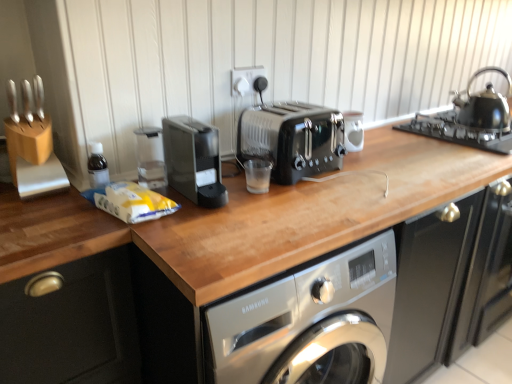
Describe the element at coordinates (353, 130) in the screenshot. I see `white glossy coffee cup at center` at that location.

In order to click on black plastic coffee machine at center in this screenshot , I will do `click(193, 160)`.

Find the location of a particular element. The height and width of the screenshot is (384, 512). wooden at center is located at coordinates (228, 264).

Image resolution: width=512 pixels, height=384 pixels. Describe the element at coordinates (228, 264) in the screenshot. I see `wooden at center` at that location.

What do you see at coordinates (33, 99) in the screenshot? This screenshot has width=512, height=384. I see `wooden knife block at upper left` at bounding box center [33, 99].

I want to click on white glossy coffee cup at center, so click(353, 130).

What's the angular difference between shiny black kettle at upper right and matte black knob at upper center's facing directions?

The facing directions of shiny black kettle at upper right and matte black knob at upper center are 4.91 degrees apart.

In the image, is shiny black kettle at upper right positioned in front of or behind matte black knob at upper center?

Visually, shiny black kettle at upper right is located behind matte black knob at upper center.

From a real-world perspective, who is located higher, shiny black kettle at upper right or matte black knob at upper center?

matte black knob at upper center is physically above.

Would you say shiny black kettle at upper right is inside or outside matte black knob at upper center?

shiny black kettle at upper right is located beyond the bounds of matte black knob at upper center.

Does black plastic coffee machine at center have a smaller size compared to white plastic socket at upper center?

Actually, black plastic coffee machine at center might be larger than white plastic socket at upper center.

From the image's perspective, does black plastic coffee machine at center appear lower than white plastic socket at upper center?

Indeed, from the image's perspective, black plastic coffee machine at center is shown beneath white plastic socket at upper center.

Considering the relative sizes of black plastic coffee machine at center and white plastic socket at upper center in the image provided, is black plastic coffee machine at center taller than white plastic socket at upper center?

Yes.

How much distance is there between black plastic coffee machine at center and white plastic socket at upper center?

A distance of 15.43 inches exists between black plastic coffee machine at center and white plastic socket at upper center.

In the scene shown: From the image's perspective, is white plastic socket at upper center above or below shiny black kettle at upper right?

Based on their image positions, white plastic socket at upper center is located above shiny black kettle at upper right.

Where is `kitchen appliance below the white plastic socket at upper center (from a real-world perspective)`? The image size is (512, 384). kitchen appliance below the white plastic socket at upper center (from a real-world perspective) is located at coordinates (484, 104).

Is white plastic socket at upper center thinner than shiny black kettle at upper right?

Yes.

Can you confirm if white plastic socket at upper center is positioned to the left of black plastic coffee machine at center?

No, white plastic socket at upper center is not to the left of black plastic coffee machine at center.

You are a GUI agent. You are given a task and a screenshot of the screen. Output one action in this format:
    pyautogui.click(x=<x>, y=<y>)
    Task: Click on the electric outlet that appears behind the black plastic coffee machine at center
    This screenshot has height=384, width=512.
    Given the screenshot: What is the action you would take?
    pyautogui.click(x=246, y=80)

Considering their positions, is white plastic socket at upper center located in front of or behind black plastic coffee machine at center?

Clearly, white plastic socket at upper center is behind black plastic coffee machine at center.

From a real-world perspective, which object stands above the other?

In real-world perspective, white plastic socket at upper center is above.

Can you confirm if matte black knob at upper center is bigger than wooden at center?

Incorrect, matte black knob at upper center is not larger than wooden at center.

From a real-world perspective, is matte black knob at upper center on top of wooden at center?

Yes, from a real-world perspective, matte black knob at upper center is above wooden at center.

Is matte black knob at upper center facing away from wooden at center?

No, wooden at center is not at the back of matte black knob at upper center.

Is matte black knob at upper center positioned behind wooden at center?

Yes, matte black knob at upper center is further from the camera.

Does matte black knob at upper center contain wooden knife block at upper left?

No, wooden knife block at upper left is located outside of matte black knob at upper center.

Considering the relative sizes of matte black knob at upper center and wooden knife block at upper left in the image provided, is matte black knob at upper center thinner than wooden knife block at upper left?

Yes.

Is matte black knob at upper center turned away from wooden knife block at upper left?

No.

Which object is closer to the camera taking this photo, matte black knob at upper center or wooden knife block at upper left?

wooden knife block at upper left.

Considering the sizes of objects black glass gas stove at upper right and wooden knife block at upper left in the image provided, who is taller, black glass gas stove at upper right or wooden knife block at upper left?

Standing taller between the two is wooden knife block at upper left.

Considering the positions of objects black glass gas stove at upper right and wooden knife block at upper left in the image provided, who is in front, black glass gas stove at upper right or wooden knife block at upper left?

wooden knife block at upper left is in front.

From the image's perspective, is black glass gas stove at upper right on wooden knife block at upper left?

Yes, from the image's perspective, black glass gas stove at upper right is above wooden knife block at upper left.

Can you see black glass gas stove at upper right touching wooden knife block at upper left?

No, black glass gas stove at upper right is not next to wooden knife block at upper left.

This screenshot has width=512, height=384. I want to click on knob above the shiny black kettle at upper right (from the image's perspective), so (260, 84).

Where is `electric outlet behind the black plastic coffee machine at center`? This screenshot has width=512, height=384. electric outlet behind the black plastic coffee machine at center is located at coordinates (246, 80).

Looking at the image, which one is located further to wooden knife block at upper left, matte black knob at upper center or black plastic coffee machine at center?

matte black knob at upper center lies further to wooden knife block at upper left than the other object.

Based on their spatial positions, is black glass gas stove at upper right or white glossy coffee cup at center closer to black metallic toaster at center?

white glossy coffee cup at center lies closer to black metallic toaster at center than the other object.

From the image, which object appears to be nearer to white glossy coffee cup at center, black plastic coffee machine at center or black metallic toaster at center?

The object closer to white glossy coffee cup at center is black metallic toaster at center.

Looking at the image, which one is located closer to white plastic socket at upper center, shiny black kettle at upper right or matte black knob at upper center?

matte black knob at upper center lies closer to white plastic socket at upper center than the other object.

Based on their spatial positions, is black plastic coffee machine at center or black metallic toaster at center further from black glass gas stove at upper right?

Answer: The object further to black glass gas stove at upper right is black plastic coffee machine at center.

Estimate the real-world distances between objects in this image. Which object is closer to shiny black kettle at upper right, white glossy coffee cup at center or wooden at center?

Based on the image, white glossy coffee cup at center appears to be nearer to shiny black kettle at upper right.

Considering their positions, is white plastic socket at upper center positioned closer to black glass gas stove at upper right than wooden at center?

wooden at center is closer to black glass gas stove at upper right.

Based on their spatial positions, is white plastic socket at upper center or shiny black kettle at upper right further from wooden knife block at upper left?

Based on the image, shiny black kettle at upper right appears to be further to wooden knife block at upper left.

The width and height of the screenshot is (512, 384). Find the location of `appliance located between wooden knife block at upper left and shiny black kettle at upper right in the left-right direction`. appliance located between wooden knife block at upper left and shiny black kettle at upper right in the left-right direction is located at coordinates (353, 130).

The height and width of the screenshot is (384, 512). I want to click on countertop situated between black plastic coffee machine at center and black glass gas stove at upper right from left to right, so click(228, 264).

The height and width of the screenshot is (384, 512). I want to click on knob between wooden knife block at upper left and black metallic toaster at center, so click(260, 84).

I want to click on knob between wooden at center and shiny black kettle at upper right from left to right, so click(x=260, y=84).